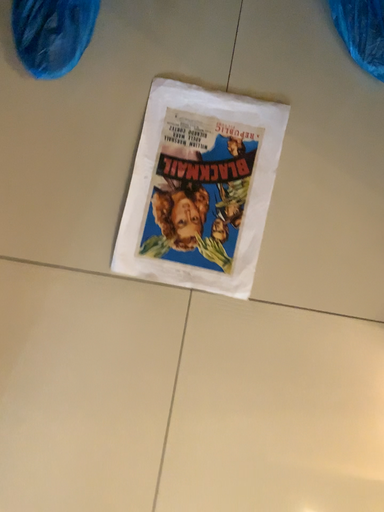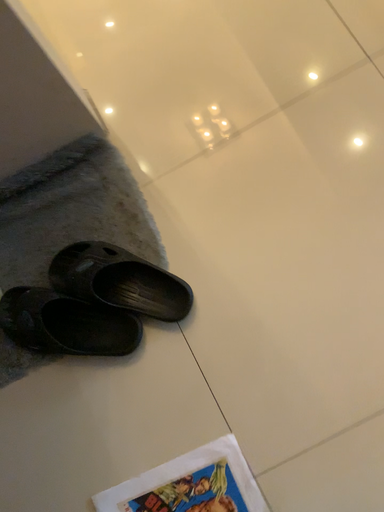
Question: Which way did the camera rotate in the video?

Choices:
 (A) rotated upward
 (B) rotated downward

Answer: (A)